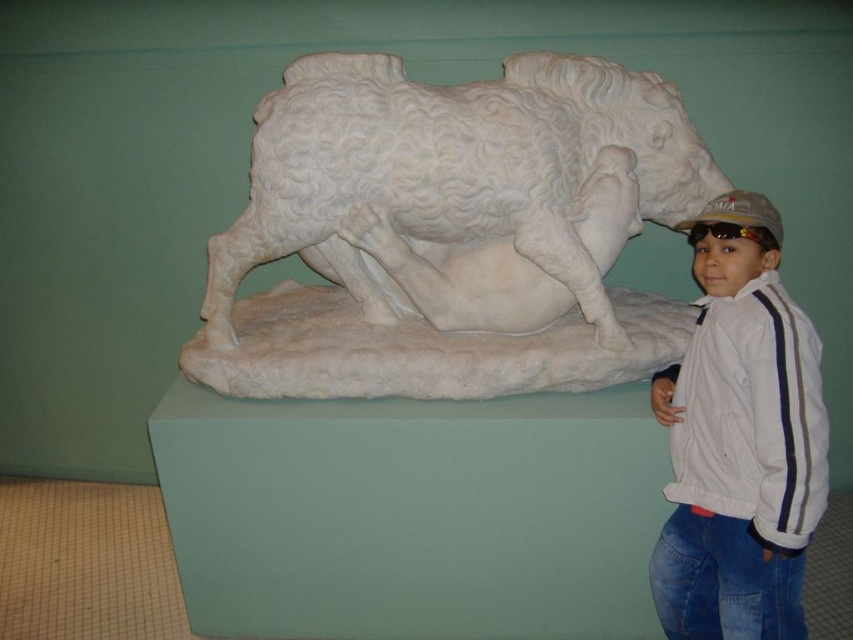
Measure the distance between white cotton jacket at lower right and camera.

white cotton jacket at lower right is 2.15 meters away from camera.

From the picture: Is white cotton jacket at lower right bigger than white matte baseball cap at upper right?

Yes, white cotton jacket at lower right is bigger than white matte baseball cap at upper right.

Who is more distant from viewer, (780, 470) or (705, 220)?

Positioned behind is point (705, 220).

You are a GUI agent. You are given a task and a screenshot of the screen. Output one action in this format:
    pyautogui.click(x=<x>, y=<y>)
    Task: Click on the white cotton jacket at lower right
    The image size is (853, 640).
    Given the screenshot: What is the action you would take?
    pyautogui.click(x=740, y=440)

Who is lower down, white marble sculpture at center or white matte baseball cap at upper right?

Positioned lower is white matte baseball cap at upper right.

Is white marble sculpture at center closer to camera compared to white matte baseball cap at upper right?

That is False.

Which is behind, point (312, 262) or point (770, 216)?

Positioned behind is point (312, 262).

Locate an element on the screen. This screenshot has height=640, width=853. white marble sculpture at center is located at coordinates pos(453,232).

Does white marble sculpture at center have a greater width compared to white cotton jacket at lower right?

Yes, white marble sculpture at center is wider than white cotton jacket at lower right.

Is white marble sculpture at center closer to the viewer compared to white cotton jacket at lower right?

No, white marble sculpture at center is further to the viewer.

Between point (430, 385) and point (733, 476), which one is positioned in front?

Point (733, 476) is more forward.

At what (x,y) coordinates should I click in order to perform the action: click on white marble sculpture at center. Please return your answer as a coordinate pair (x, y). This screenshot has width=853, height=640. Looking at the image, I should click on (453, 232).